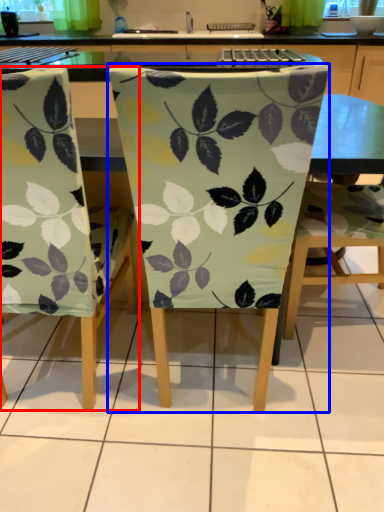
Question: Which object is further to the camera taking this photo, chair (highlighted by a red box) or chair (highlighted by a blue box)?

Choices:
 (A) chair
 (B) chair

Answer: (A)